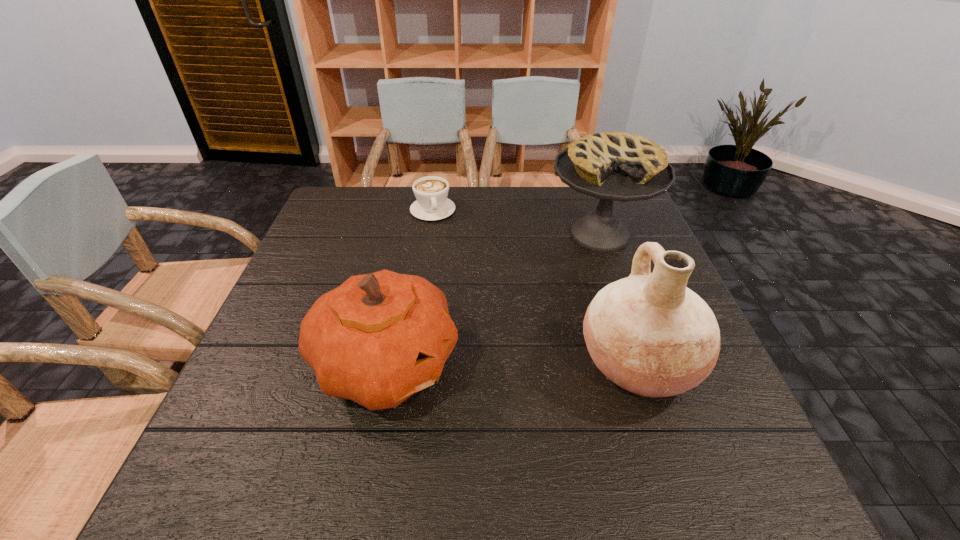
The image size is (960, 540). I want to click on vacant space situated 0.070m to the right of the cappuccino's handle, so pyautogui.click(x=442, y=237).

This screenshot has height=540, width=960. Find the location of `pie located in the far edge section of the desktop`. pie located in the far edge section of the desktop is located at coordinates (612, 166).

In order to click on cappuccino at the far edge in this screenshot , I will do `click(431, 192)`.

Locate an element on the screen. The height and width of the screenshot is (540, 960). pumpkin located in the near edge section of the desktop is located at coordinates (378, 338).

Where is `pottery present at the near edge`? The image size is (960, 540). pottery present at the near edge is located at coordinates (648, 333).

The image size is (960, 540). Identify the location of object that is positioned at the left edge. (378, 338).

Image resolution: width=960 pixels, height=540 pixels. I want to click on pottery located at the right edge, so pos(648,333).

What are the coordinates of `pie present at the right edge` in the screenshot? It's located at (612, 166).

The width and height of the screenshot is (960, 540). In order to click on object present at the near left corner in this screenshot , I will do `click(378, 338)`.

Locate an element on the screen. The height and width of the screenshot is (540, 960). object positioned at the far right corner is located at coordinates (612, 166).